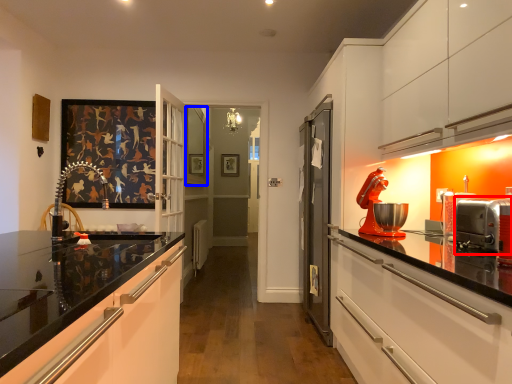
Question: Which object appears farthest to the camera in this image, appliance (highlighted by a red box) or window (highlighted by a blue box)?

Choices:
 (A) appliance
 (B) window

Answer: (B)